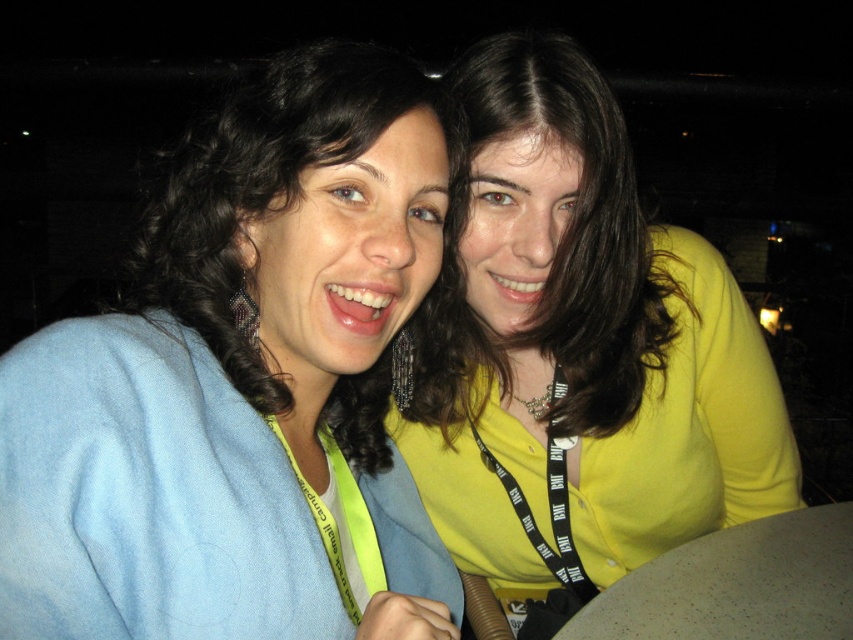
Question: Among these objects, which one is farthest from the camera?

Choices:
 (A) blue fabric at left
 (B) yellow matte shirt at upper right

Answer: (B)

Question: Is blue fabric at left closer to camera compared to yellow matte shirt at upper right?

Choices:
 (A) no
 (B) yes

Answer: (B)

Question: Can you confirm if blue fabric at left is positioned below yellow matte shirt at upper right?

Choices:
 (A) no
 (B) yes

Answer: (B)

Question: Which of the following is the closest to the observer?

Choices:
 (A) blue fabric at left
 (B) yellow matte shirt at upper right

Answer: (A)

Question: Can you confirm if blue fabric at left is smaller than yellow matte shirt at upper right?

Choices:
 (A) yes
 (B) no

Answer: (A)